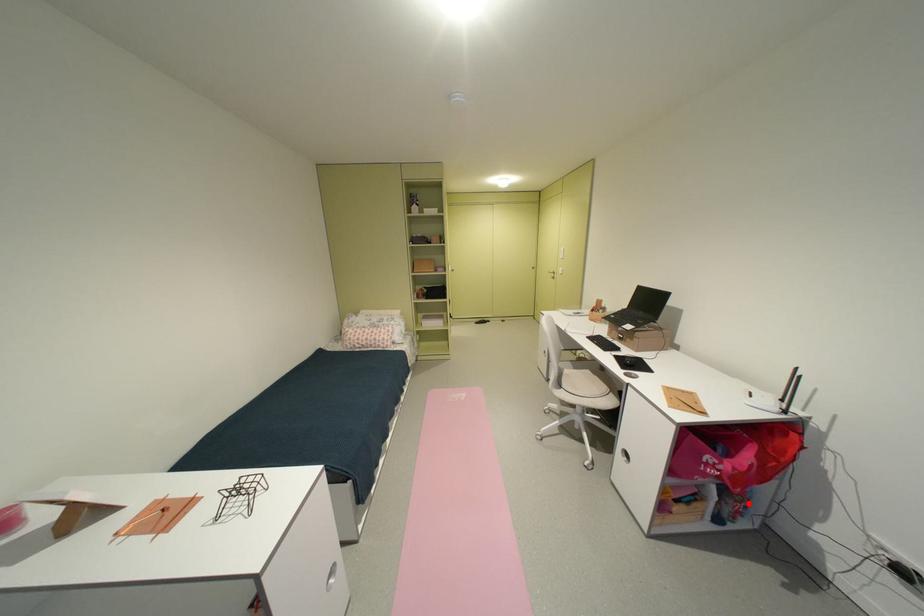
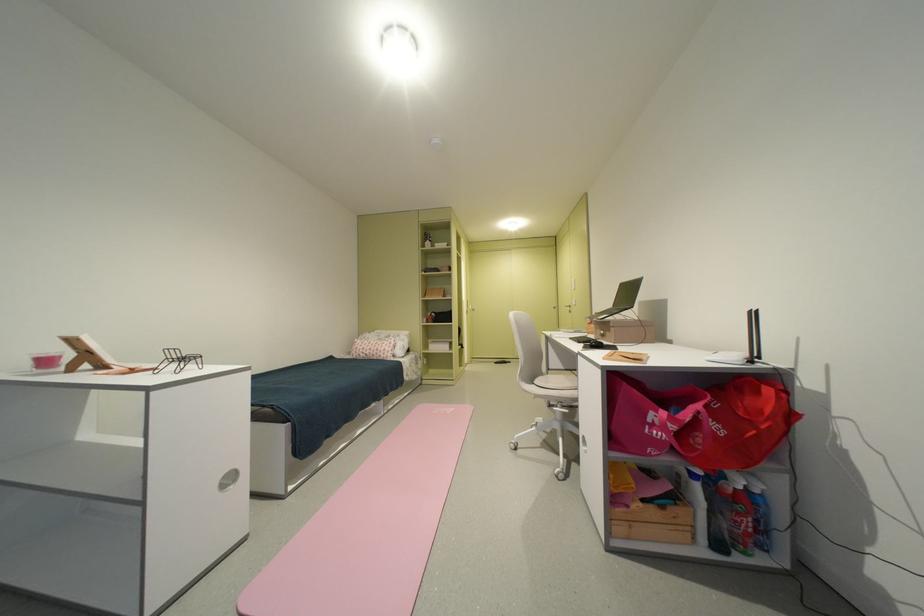
Question: A red point is marked in image1. In image2, is the corresponding 3D point closer to the camera or farther? Reply with the corresponding letter.

Choices:
 (A) The corresponding 3D point is closer.
 (B) The corresponding 3D point is farther.

Answer: (A)